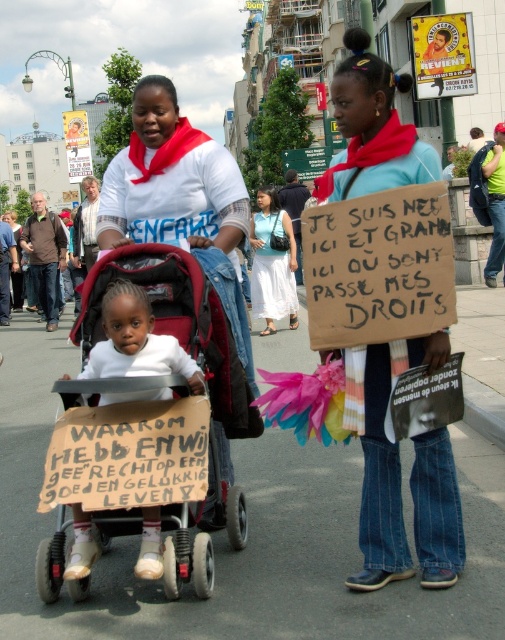
Question: Is the position of blue denim jeans at center less distant than that of white cotton dress at center?

Choices:
 (A) yes
 (B) no

Answer: (A)

Question: Which of these objects is positioned farthest from the matte plastic baby carriage at center?

Choices:
 (A) white cotton dress at center
 (B) blue denim jeans at center

Answer: (A)

Question: Does blue denim jeans at center come in front of matte plastic baby carriage at center?

Choices:
 (A) no
 (B) yes

Answer: (B)

Question: Which of the following is the farthest from the observer?

Choices:
 (A) (251, 228)
 (B) (348, 177)
 (C) (169, 257)

Answer: (A)

Question: Which point is farther from the camera taking this photo?

Choices:
 (A) (273, 189)
 (B) (122, 253)

Answer: (A)

Question: Is blue denim jeans at center wider than white cotton dress at center?

Choices:
 (A) no
 (B) yes

Answer: (B)